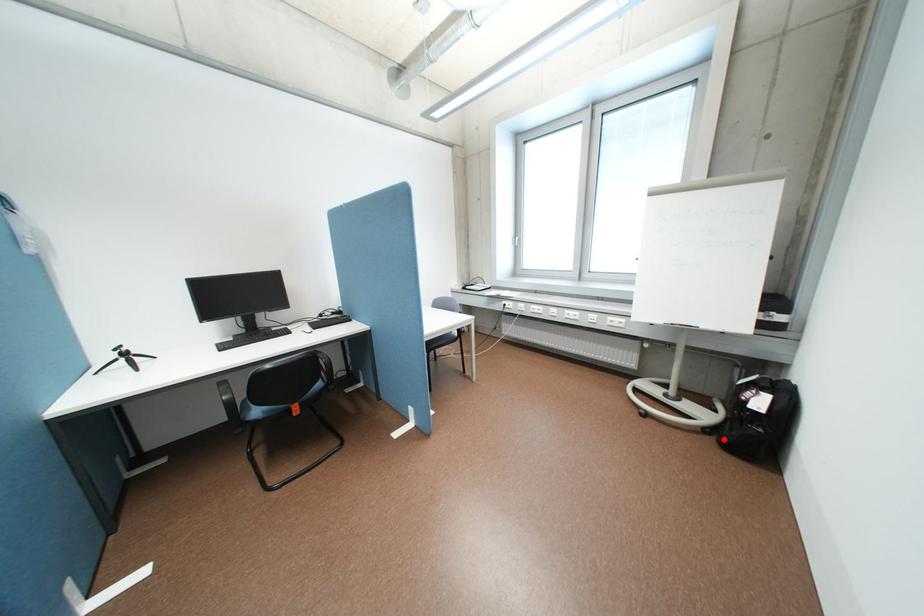
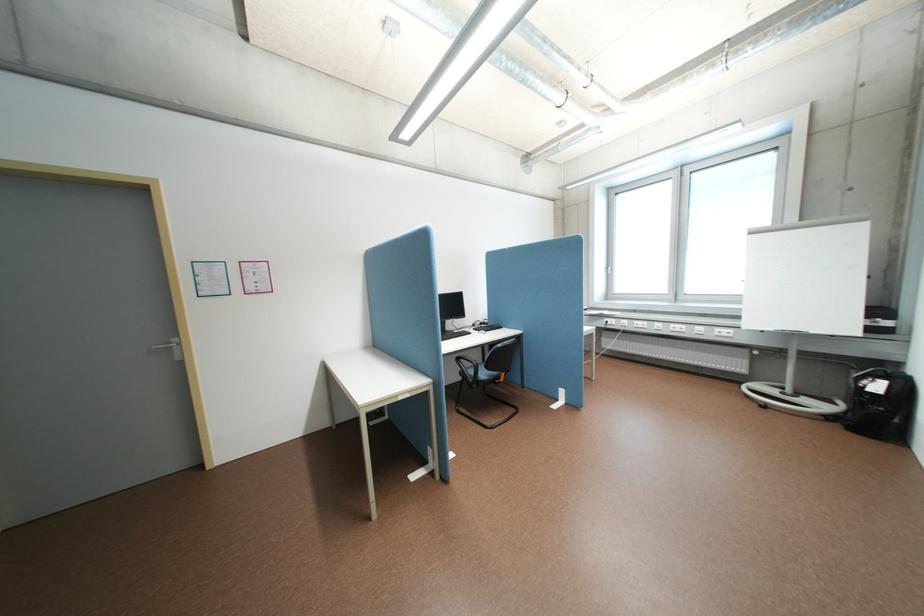
Question: I am providing you with two images of the same scene from different viewpoints. A red point is shown in image1. For the corresponding object point in image2, is it positioned nearer or farther from the camera?

Choices:
 (A) Nearer
 (B) Farther

Answer: (A)